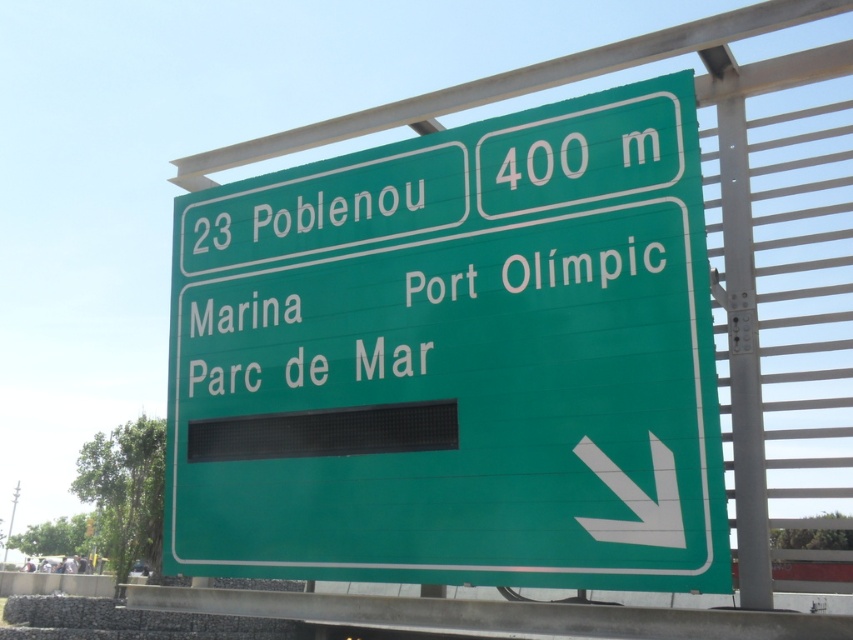
Question: Can you confirm if green matte sign at upper center is positioned above green metallic sign at center?

Choices:
 (A) no
 (B) yes

Answer: (B)

Question: Which of the following is the farthest from the observer?

Choices:
 (A) green matte sign at center
 (B) green metallic sign at center
 (C) green matte sign at upper center

Answer: (C)

Question: Which point is closer to the camera?

Choices:
 (A) green matte sign at center
 (B) green metallic sign at center
 (C) green matte sign at upper center

Answer: (A)

Question: Does green matte sign at upper center lie in front of green metallic sign at center?

Choices:
 (A) no
 (B) yes

Answer: (A)

Question: Does green matte sign at center appear on the right side of green metallic sign at center?

Choices:
 (A) no
 (B) yes

Answer: (A)

Question: Which of the following is the closest to the observer?

Choices:
 (A) (560, 378)
 (B) (292, 317)
 (C) (432, 220)

Answer: (A)